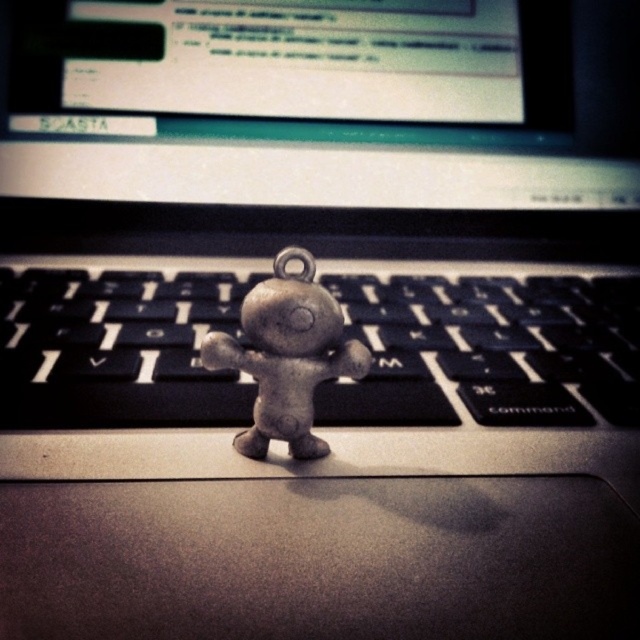
You are trying to place a small keychain on your desk without blocking any important items. You have a black matte keyboard at center and a metallic figure at center. Which object is taller and might require more vertical space?

The black matte keyboard at center is taller than the metallic figure at center, so it requires more vertical space.

You are trying to place a small keychain on your desk so it doesn not block the keyboard. You have a black matte keyboard at center and a metallic figure at center. Based on their positions, which object is closer to the left edge of the desk?

The metallic figure at center is closer to the left edge of the desk because the black matte keyboard at center is positioned to its right.

You are trying to locate the black matte keyboard at center in the image. What are the coordinates where you can find it?

The black matte keyboard at center can be found at coordinates point [486,349].